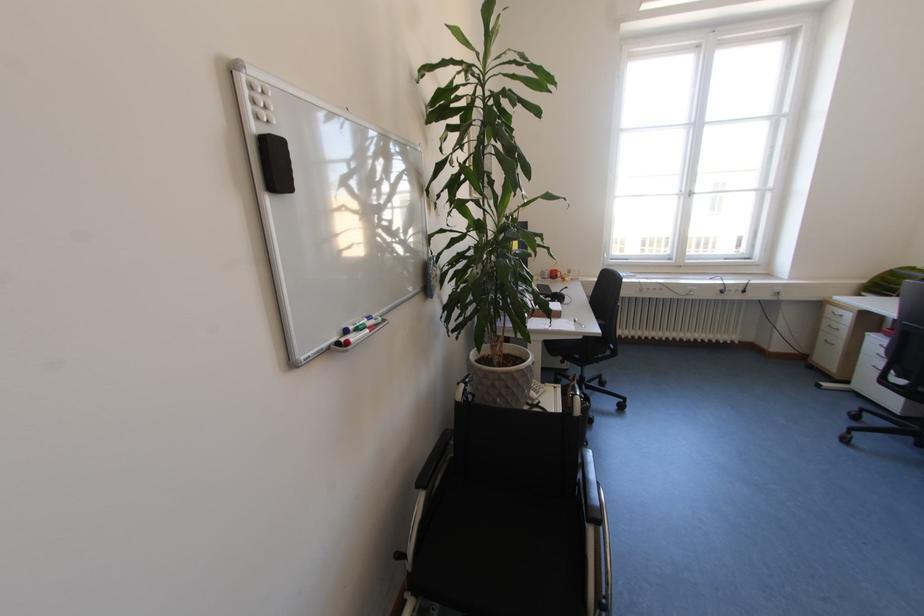
Locate an element on the screen. wheelchair push rim is located at coordinates (604, 559).